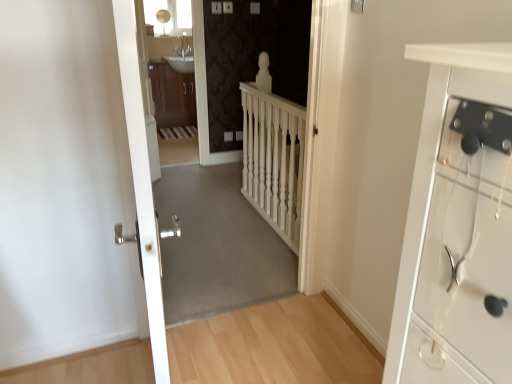
Question: From a real-world perspective, relative to wooden cabinet at center, is white textured stairwell at center vertically above or below?

Choices:
 (A) above
 (B) below

Answer: (B)

Question: Do you think white textured stairwell at center is within wooden cabinet at center, or outside of it?

Choices:
 (A) inside
 (B) outside

Answer: (B)

Question: Considering the real-world distances, which object is closest to the white wooden balustrade at center?

Choices:
 (A) white plastic electric outlet at center
 (B) light wood floor at center
 (C) white textured stairwell at center
 (D) matte white sink at center, the first corridor viewed from the top
 (E) white metallic door at center

Answer: (B)

Question: Which object is the farthest from the white plastic electric outlet at center?

Choices:
 (A) white textured stairwell at center
 (B) light wood floor at center
 (C) matte white sink at center, which is the second corridor in bottom-to-top order
 (D) white wooden balustrade at center
 (E) wooden cabinet at center

Answer: (B)